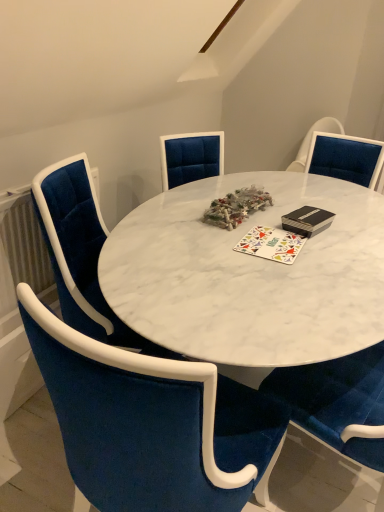
Question: In the image, is velvet blue chair at center, the 2th chair positioned from the back, positioned in front of or behind velvet blue chair at left, the 2th chair when ordered from front to back?

Choices:
 (A) front
 (B) behind

Answer: (A)

Question: Looking at the image, does velvet blue chair at center, the 2th chair positioned from the back, seem bigger or smaller compared to velvet blue chair at left, the 2th chair when ordered from front to back?

Choices:
 (A) big
 (B) small

Answer: (A)

Question: Considering the real-world distances, which object is farthest from the velvet blue chair at center, positioned as the first chair in front-to-back order?

Choices:
 (A) multicolored fabric mat at center
 (B) velvet blue chair at left, the 1th chair in the back-to-front sequence

Answer: (A)

Question: Which of these objects is positioned farthest from the velvet blue chair at left, the 1th chair in the back-to-front sequence?

Choices:
 (A) velvet blue chair at center, positioned as the first chair in front-to-back order
 (B) multicolored fabric mat at center

Answer: (B)